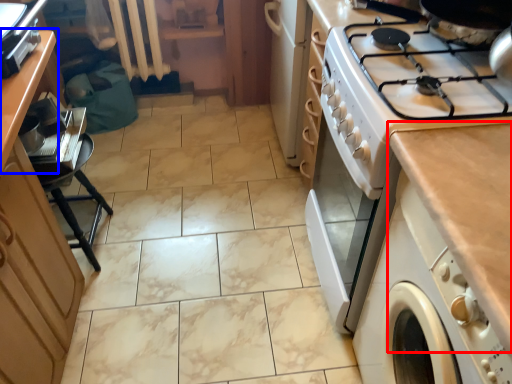
Question: Which object appears closest to the camera in this image, countertop (highlighted by a red box) or counter (highlighted by a blue box)?

Choices:
 (A) countertop
 (B) counter

Answer: (A)